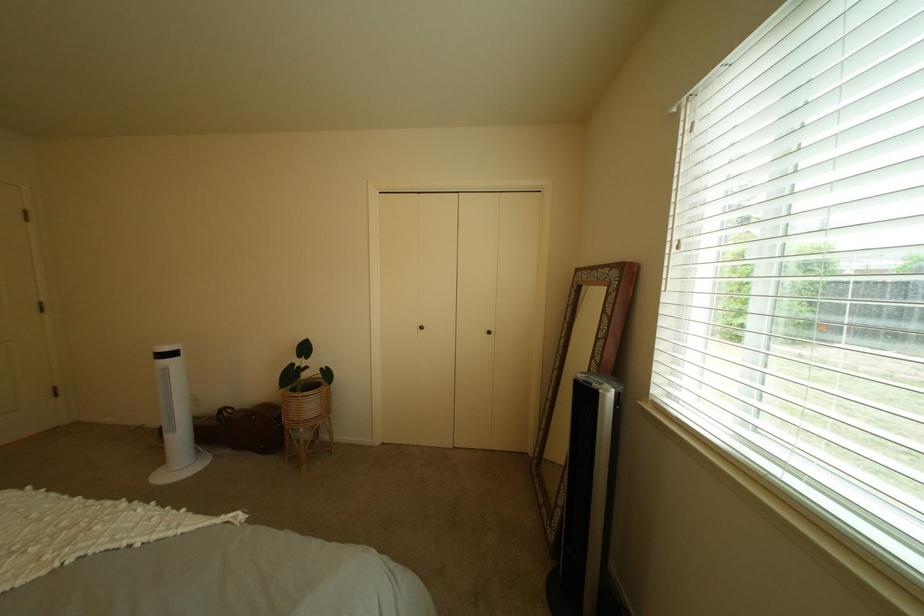
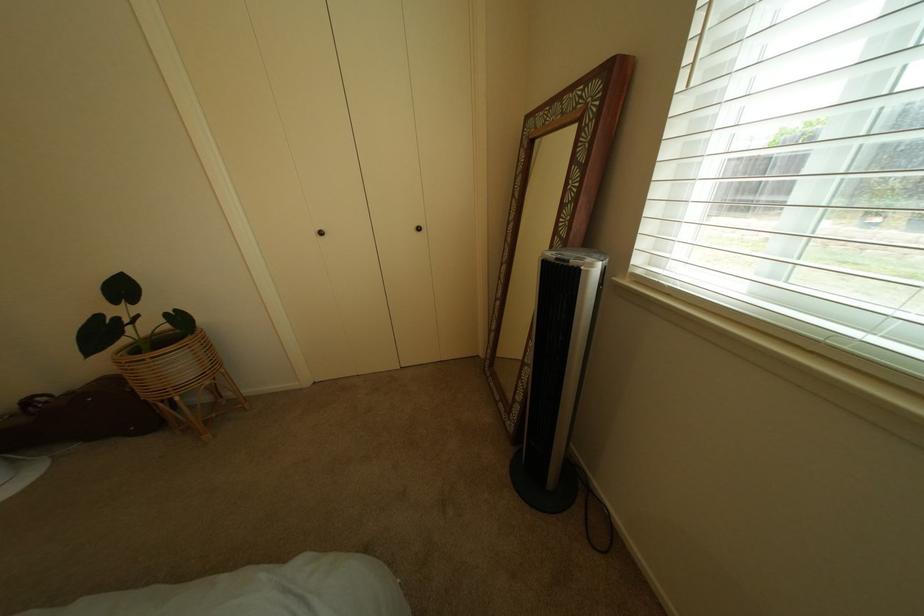
Question: I am providing you with two images of the same scene from different viewpoints. Please identify which objects are invisible in image2.

Choices:
 (A) plant in wicker stand
 (B) closet door knob
 (C) black tower fan
 (D) none of these

Answer: (D)